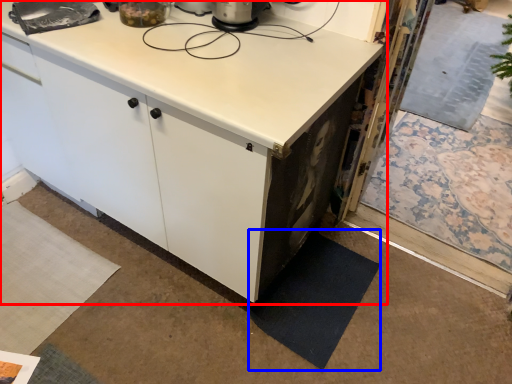
Question: Among these objects, which one is farthest to the camera, cabinetry (highlighted by a red box) or mat (highlighted by a blue box)?

Choices:
 (A) cabinetry
 (B) mat

Answer: (B)